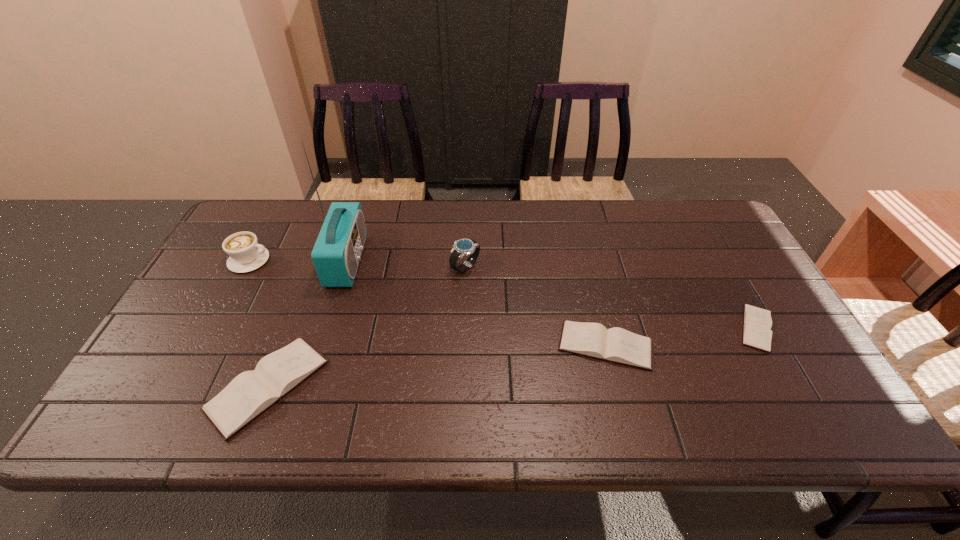
Locate an element on the screen. The height and width of the screenshot is (540, 960). the leftmost diary is located at coordinates (248, 395).

Where is `the second diary from right to left`? the second diary from right to left is located at coordinates (617, 345).

Where is `the second object from right to left`? The width and height of the screenshot is (960, 540). the second object from right to left is located at coordinates (617, 345).

Where is `the rightmost object`? This screenshot has height=540, width=960. the rightmost object is located at coordinates (757, 322).

This screenshot has width=960, height=540. I want to click on the rightmost diary, so click(757, 322).

Locate an element on the screen. cappuccino is located at coordinates (245, 253).

Locate an element on the screen. The width and height of the screenshot is (960, 540). the fourth shortest object is located at coordinates (245, 253).

Find the location of `the tallest object`. the tallest object is located at coordinates (336, 254).

At what (x,y) coordinates should I click in order to perform the action: click on watch. Please return your answer as a coordinate pair (x, y). Looking at the image, I should click on (463, 247).

What are the coordinates of `vacant space located 0.100m on the left of the leftmost diary` in the screenshot? It's located at click(x=170, y=386).